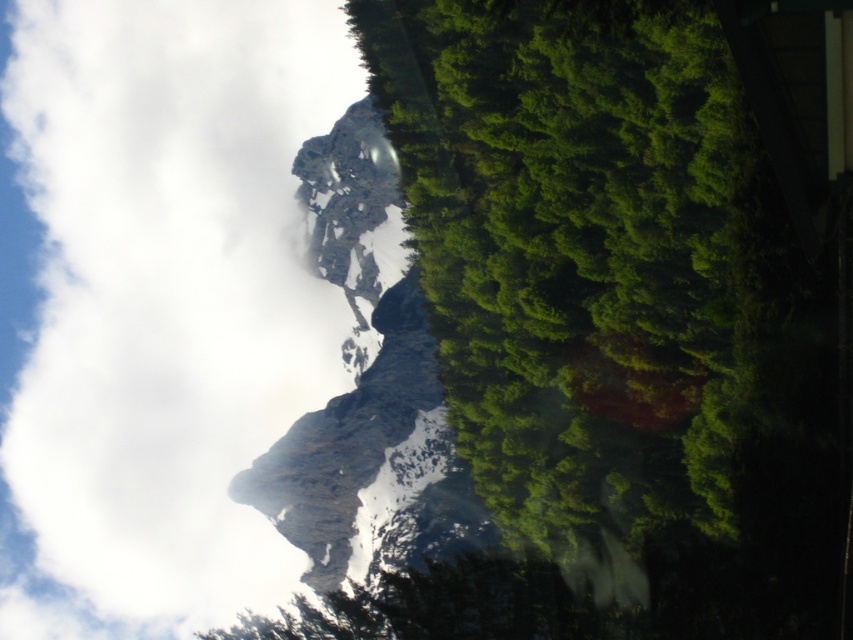
You are standing at the point with coordinates point (544, 493) and want to walk towards the point with coordinates point (106, 298). Will the mountain on the left side of the frame block your path?

Point (106, 298) is behind point (544, 493), so the mountain on the left side of the frame will block your path.

You are an airplane pilot flying above the mountainous landscape. You notice the white fluffy cloud at upper left and the green leafy tree at center. Which object is higher in the sky?

The white fluffy cloud at upper left is much taller than the green leafy tree at center, so the cloud is higher in the sky.

You are standing at the base of the mountains in the image and want to reach the point marked at coordinates point (152,92). Given that you can walk at a speed of 5 meters per minute, how long will it take you to reach that point?

The distance of point (152,92) from viewer is 514.83 meters. At a walking speed of 5 meters per minute, it would take 514.83 divided by 5, which is approximately 102.97 minutes. So, roughly 103 minutes to reach the point.